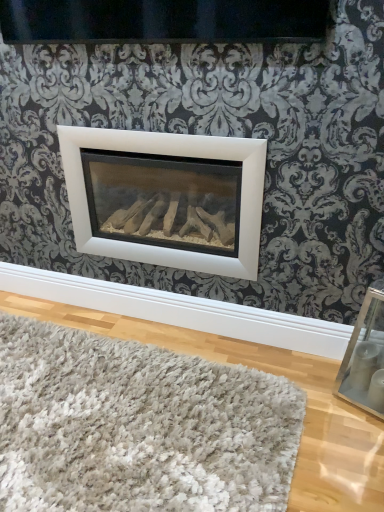
Question: Are white matte fireplace at center and white shaggy rug at lower center beside each other?

Choices:
 (A) yes
 (B) no

Answer: (B)

Question: From a real-world perspective, is white matte fireplace at center physically below white shaggy rug at lower center?

Choices:
 (A) yes
 (B) no

Answer: (B)

Question: Is white matte fireplace at center looking in the opposite direction of white shaggy rug at lower center?

Choices:
 (A) yes
 (B) no

Answer: (B)

Question: Is white matte fireplace at center bigger than white shaggy rug at lower center?

Choices:
 (A) no
 (B) yes

Answer: (B)

Question: From the image's perspective, is white matte fireplace at center below white shaggy rug at lower center?

Choices:
 (A) no
 (B) yes

Answer: (A)

Question: Is white shaggy rug at lower center wider or thinner than white matte fireplace at center?

Choices:
 (A) wide
 (B) thin

Answer: (A)

Question: Would you say white shaggy rug at lower center is inside or outside white matte fireplace at center?

Choices:
 (A) inside
 (B) outside

Answer: (B)

Question: Is white shaggy rug at lower center taller or shorter than white matte fireplace at center?

Choices:
 (A) short
 (B) tall

Answer: (A)

Question: Considering their positions, is white shaggy rug at lower center located in front of or behind white matte fireplace at center?

Choices:
 (A) front
 (B) behind

Answer: (A)

Question: From a real-world perspective, is white matte fireplace at center above or below white shaggy rug at lower center?

Choices:
 (A) above
 (B) below

Answer: (A)

Question: In the image, is white matte fireplace at center on the left side or the right side of white shaggy rug at lower center?

Choices:
 (A) left
 (B) right

Answer: (B)

Question: Is white matte fireplace at center bigger or smaller than white shaggy rug at lower center?

Choices:
 (A) big
 (B) small

Answer: (A)

Question: Is white matte fireplace at center taller or shorter than white shaggy rug at lower center?

Choices:
 (A) short
 (B) tall

Answer: (B)

Question: Is white matte fireplace at center bigger or smaller than clear glass picture frame at lower right?

Choices:
 (A) big
 (B) small

Answer: (A)

Question: From a real-world perspective, is white matte fireplace at center above or below clear glass picture frame at lower right?

Choices:
 (A) above
 (B) below

Answer: (A)